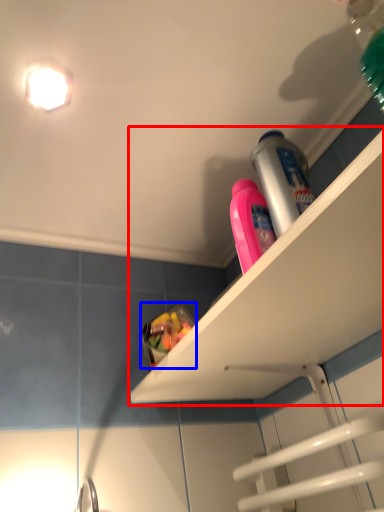
Question: Which object appears farthest to the camera in this image, shelf (highlighted by a red box) or food (highlighted by a blue box)?

Choices:
 (A) shelf
 (B) food

Answer: (B)